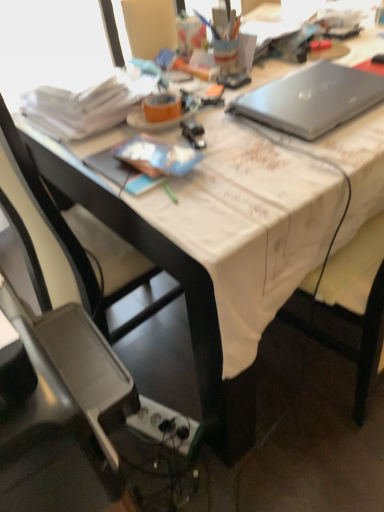
Question: Is plastic gray chair at lower left, the 2th chair viewed from the back, oriented towards black plastic chair at lower left, which is the first chair from back to front?

Choices:
 (A) no
 (B) yes

Answer: (A)

Question: Does plastic gray chair at lower left, arranged as the first chair when viewed from the front, have a larger size compared to black plastic chair at lower left, which is the first chair from back to front?

Choices:
 (A) yes
 (B) no

Answer: (B)

Question: Can we say plastic gray chair at lower left, the 2th chair viewed from the back, lies outside black plastic chair at lower left, which appears as the 2th chair when viewed from the front?

Choices:
 (A) no
 (B) yes

Answer: (B)

Question: Is plastic gray chair at lower left, the 2th chair viewed from the back, positioned before black plastic chair at lower left, which is the first chair from back to front?

Choices:
 (A) no
 (B) yes

Answer: (B)

Question: Is plastic gray chair at lower left, arranged as the first chair when viewed from the front, at the left side of black plastic chair at lower left, which appears as the 2th chair when viewed from the front?

Choices:
 (A) yes
 (B) no

Answer: (A)

Question: Is point (165, 408) positioned closer to the camera than point (96, 242)?

Choices:
 (A) closer
 (B) farther

Answer: (B)

Question: Based on their sizes in the image, would you say white plastic power outlet at lower center is bigger or smaller than black plastic chair at lower left, which is the first chair from back to front?

Choices:
 (A) small
 (B) big

Answer: (A)

Question: In terms of width, does white plastic power outlet at lower center look wider or thinner when compared to black plastic chair at lower left, which is the first chair from back to front?

Choices:
 (A) thin
 (B) wide

Answer: (A)

Question: Is white plastic power outlet at lower center taller or shorter than black plastic chair at lower left, which appears as the 2th chair when viewed from the front?

Choices:
 (A) tall
 (B) short

Answer: (B)

Question: From a real-world perspective, is silver metallic laptop at upper right positioned above or below black plastic chair at lower left, which is the first chair from back to front?

Choices:
 (A) below
 (B) above

Answer: (B)

Question: Based on their sizes in the image, would you say silver metallic laptop at upper right is bigger or smaller than black plastic chair at lower left, which appears as the 2th chair when viewed from the front?

Choices:
 (A) small
 (B) big

Answer: (A)

Question: From their relative heights in the image, would you say silver metallic laptop at upper right is taller or shorter than black plastic chair at lower left, which is the first chair from back to front?

Choices:
 (A) short
 (B) tall

Answer: (A)

Question: In the image, is silver metallic laptop at upper right positioned in front of or behind black plastic chair at lower left, which appears as the 2th chair when viewed from the front?

Choices:
 (A) behind
 (B) front

Answer: (A)

Question: Considering the positions of point (99, 311) and point (84, 377), is point (99, 311) closer or farther from the camera than point (84, 377)?

Choices:
 (A) closer
 (B) farther

Answer: (B)

Question: From the image's perspective, is black plastic chair at lower left, which appears as the 2th chair when viewed from the front, positioned above or below plastic gray chair at lower left, arranged as the first chair when viewed from the front?

Choices:
 (A) above
 (B) below

Answer: (A)